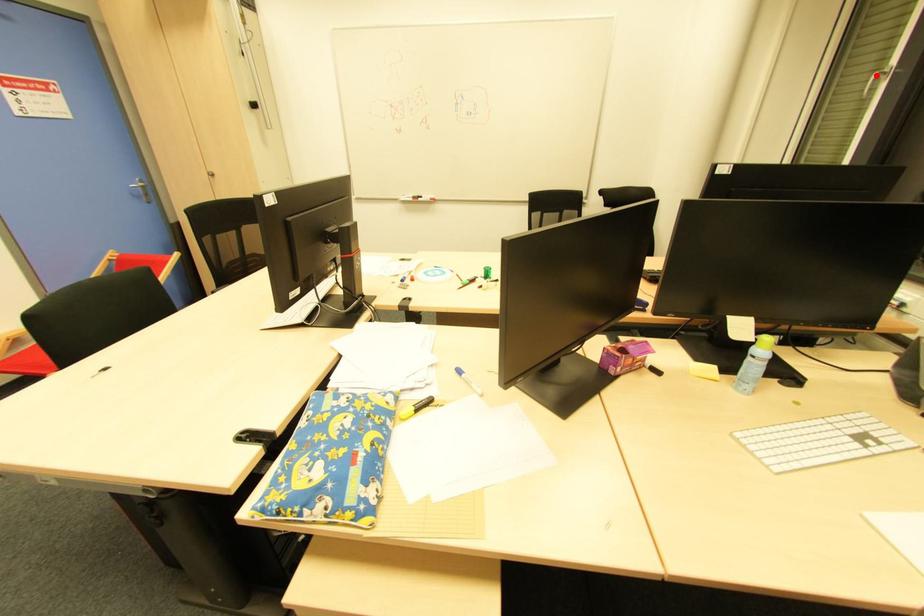
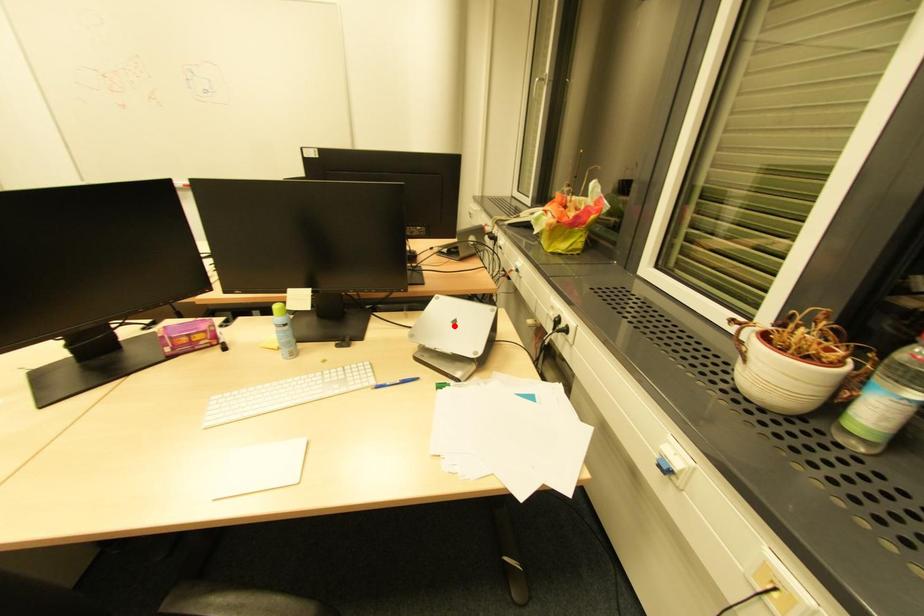
I am providing you with two images of the same scene from different viewpoints. A red point is marked on the first image and another point is marked on the second image. Are the points marked in image1 and image2 representing the same 3D position?

No